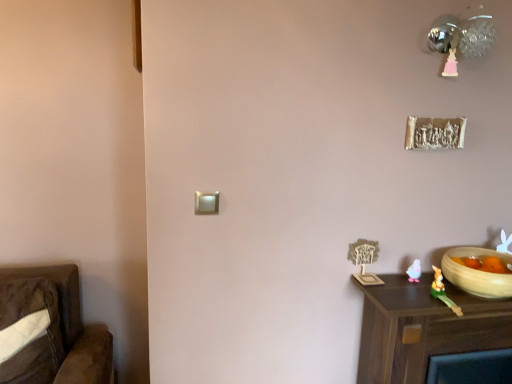
Find the location of a particular element. This screenshot has width=512, height=384. free location to the right of pink plastic toy at lower right, marked as the first toy in a back-to-front arrangement is located at coordinates (443, 287).